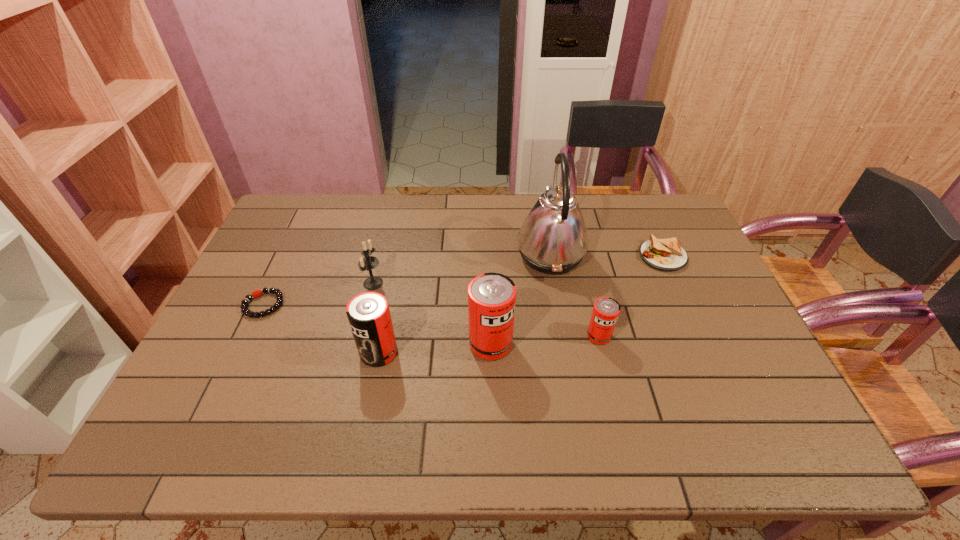
Select which can is the third closest to the sandwich. Please provide its 2D coordinates. Your answer should be formatted as a tuple, i.e. [(x, y)], where the tuple contains the x and y coordinates of a point satisfying the conditions above.

[(368, 313)]

The image size is (960, 540). I want to click on vacant space that satisfies the following two spatial constraints: 1. on the front side of the leftmost can; 2. on the right side of the bracelet, so click(x=240, y=353).